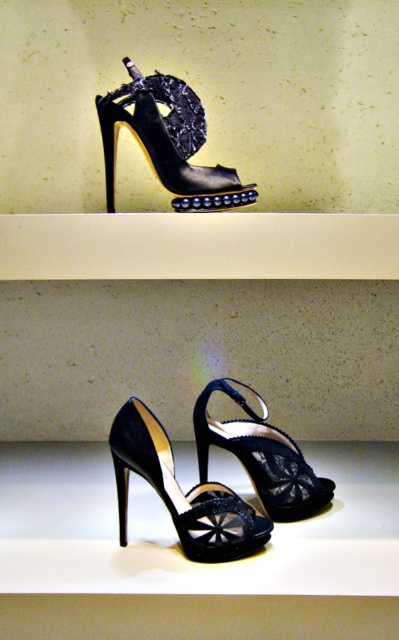
Is shiny black sandal at center to the right of matte black sandal at center from the viewer's perspective?

Incorrect, shiny black sandal at center is not on the right side of matte black sandal at center.

Which is behind, point (114, 436) or point (195, 422)?

The point (195, 422) is behind.

The height and width of the screenshot is (640, 399). Find the location of `shiny black sandal at center`. shiny black sandal at center is located at coordinates (181, 492).

Is black leather sandal at upper center below matte black sandal at center?

Actually, black leather sandal at upper center is above matte black sandal at center.

Is black leather sandal at upper center above matte black sandal at center?

Yes.

The width and height of the screenshot is (399, 640). Describe the element at coordinates (167, 141) in the screenshot. I see `black leather sandal at upper center` at that location.

Where is `black leather sandal at upper center`? black leather sandal at upper center is located at coordinates (167, 141).

Does black leather sandal at upper center come in front of shiny black sandal at center?

No, it is behind shiny black sandal at center.

Looking at this image, between black leather sandal at upper center and shiny black sandal at center, which one has less height?

shiny black sandal at center

This screenshot has width=399, height=640. What do you see at coordinates (167, 141) in the screenshot?
I see `black leather sandal at upper center` at bounding box center [167, 141].

Find the location of a particular element. This screenshot has width=399, height=640. black leather sandal at upper center is located at coordinates (167, 141).